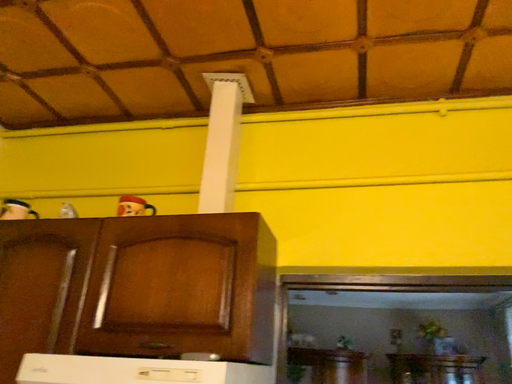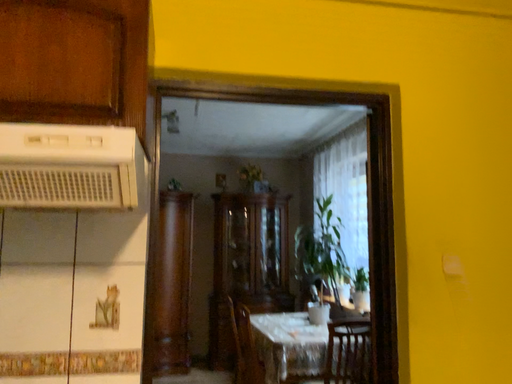
Question: Which way did the camera rotate in the video?

Choices:
 (A) rotated right
 (B) rotated left

Answer: (A)